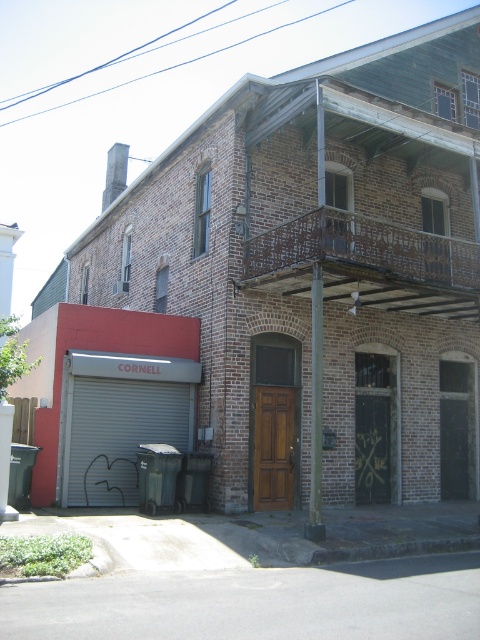
You are standing in front of the two story brick building with a red awning. There are two points marked on the building facade. The first point is at coordinate point (177, 436) and the second is at point (317, 508). Which point is closer to you?

Point (177, 436) is closer to you because it is further to the viewer than point (317, 508).

You are a delivery person trying to enter the building. You see the gray metallic garage door at lower left and the brown wood door at center. Which door is taller and should you consider if you have a tall package?

The gray metallic garage door at lower left is taller than the brown wood door at center, so you should consider the gray metallic garage door at lower left if you have a tall package.